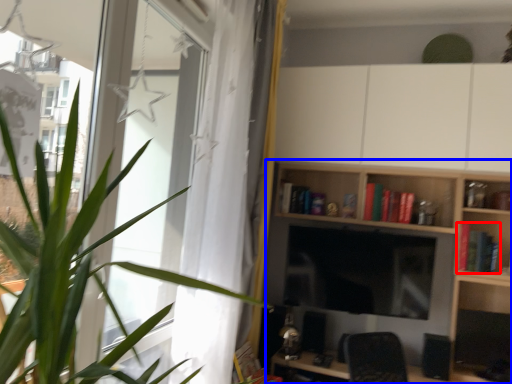
Question: Which of the following is the closest to the observer, book (highlighted by a red box) or shelf (highlighted by a blue box)?

Choices:
 (A) book
 (B) shelf

Answer: (B)